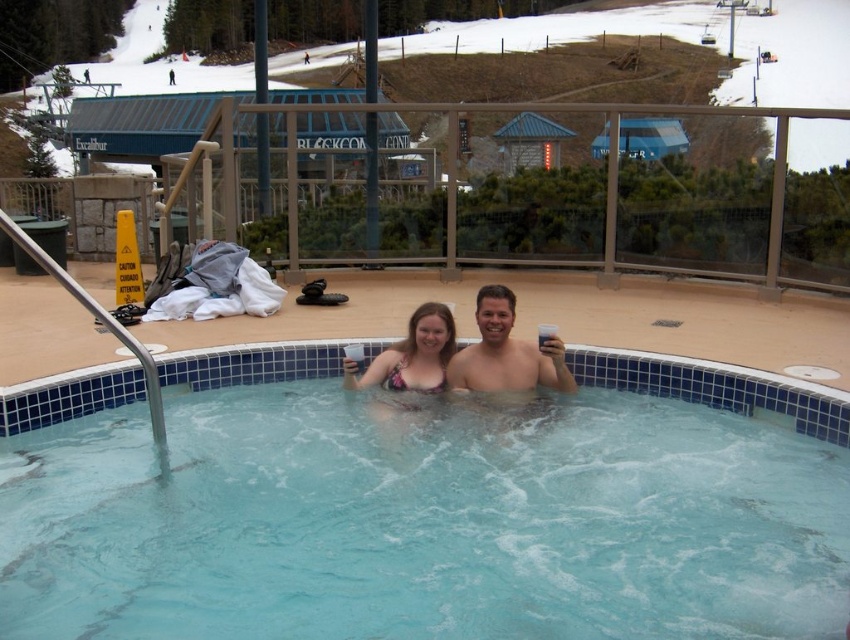
Question: Is blue tile swimming pool at center wider than clear plastic cups at center?

Choices:
 (A) yes
 (B) no

Answer: (A)

Question: Can you confirm if clear plastic cups at center is wider than smooth skin man at center?

Choices:
 (A) no
 (B) yes

Answer: (B)

Question: Estimate the real-world distances between objects in this image. Which object is farther from the blue tile swimming pool at center?

Choices:
 (A) clear plastic cups at center
 (B) patterned bikini top at center
 (C) smooth skin man at center

Answer: (C)

Question: Is the position of clear plastic cups at center more distant than that of patterned bikini top at center?

Choices:
 (A) no
 (B) yes

Answer: (B)

Question: Which point appears closest to the camera in this image?

Choices:
 (A) (479, 291)
 (B) (439, 349)

Answer: (B)

Question: Estimate the real-world distances between objects in this image. Which object is closer to the patterned bikini top at center?

Choices:
 (A) blue tile swimming pool at center
 (B) smooth skin man at center

Answer: (B)